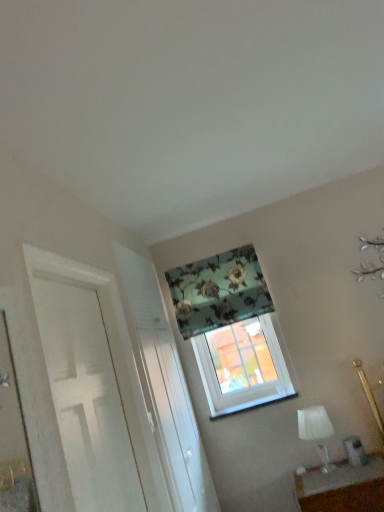
Question: Is floral fabric curtain at upper center wider than white painted wood door at left?

Choices:
 (A) no
 (B) yes

Answer: (B)

Question: Considering the relative sizes of floral fabric curtain at upper center and white painted wood door at left in the image provided, is floral fabric curtain at upper center thinner than white painted wood door at left?

Choices:
 (A) yes
 (B) no

Answer: (B)

Question: Is floral fabric curtain at upper center far away from white painted wood door at left?

Choices:
 (A) yes
 (B) no

Answer: (A)

Question: Can we say floral fabric curtain at upper center lies outside white painted wood door at left?

Choices:
 (A) no
 (B) yes

Answer: (B)

Question: From the image's perspective, would you say floral fabric curtain at upper center is positioned over white painted wood door at left?

Choices:
 (A) no
 (B) yes

Answer: (B)

Question: Is white plastic window sill at center inside or outside of white textured screen door at center?

Choices:
 (A) inside
 (B) outside

Answer: (B)

Question: Considering their positions, is white plastic window sill at center located in front of or behind white textured screen door at center?

Choices:
 (A) front
 (B) behind

Answer: (B)

Question: Is white plastic window sill at center bigger or smaller than white textured screen door at center?

Choices:
 (A) small
 (B) big

Answer: (A)

Question: Looking at their shapes, would you say white plastic window sill at center is wider or thinner than white textured screen door at center?

Choices:
 (A) wide
 (B) thin

Answer: (A)

Question: From a real-world perspective, is floral fabric curtain at upper center above or below white painted wood door at left?

Choices:
 (A) below
 (B) above

Answer: (B)

Question: In terms of size, does floral fabric curtain at upper center appear bigger or smaller than white painted wood door at left?

Choices:
 (A) small
 (B) big

Answer: (A)

Question: From the image's perspective, is floral fabric curtain at upper center located above or below white painted wood door at left?

Choices:
 (A) below
 (B) above

Answer: (B)

Question: Considering their positions, is floral fabric curtain at upper center located in front of or behind white painted wood door at left?

Choices:
 (A) behind
 (B) front

Answer: (A)

Question: From the image's perspective, relative to matte white table at lower right, is white textured screen door at center above or below?

Choices:
 (A) above
 (B) below

Answer: (A)

Question: Is white textured screen door at center wider or thinner than matte white table at lower right?

Choices:
 (A) wide
 (B) thin

Answer: (B)